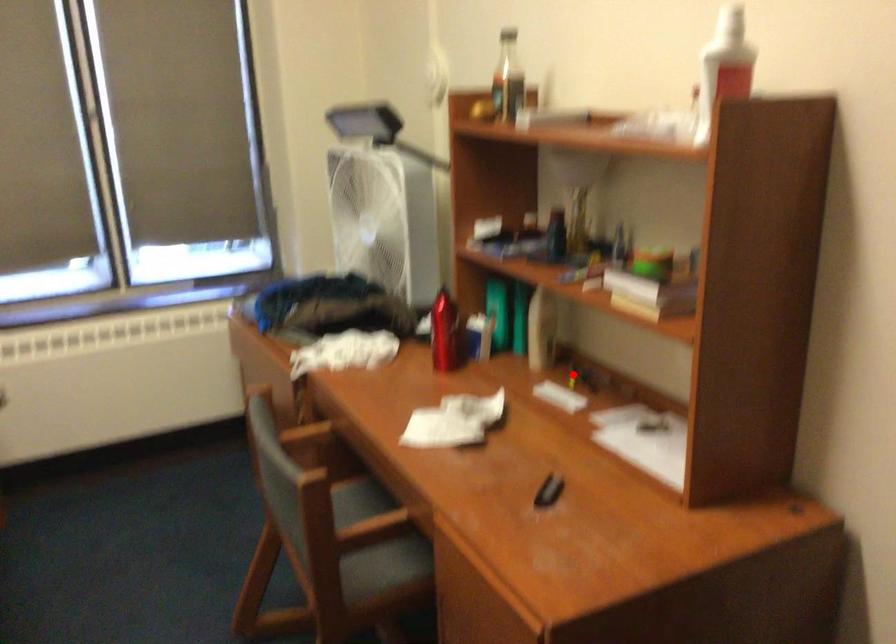
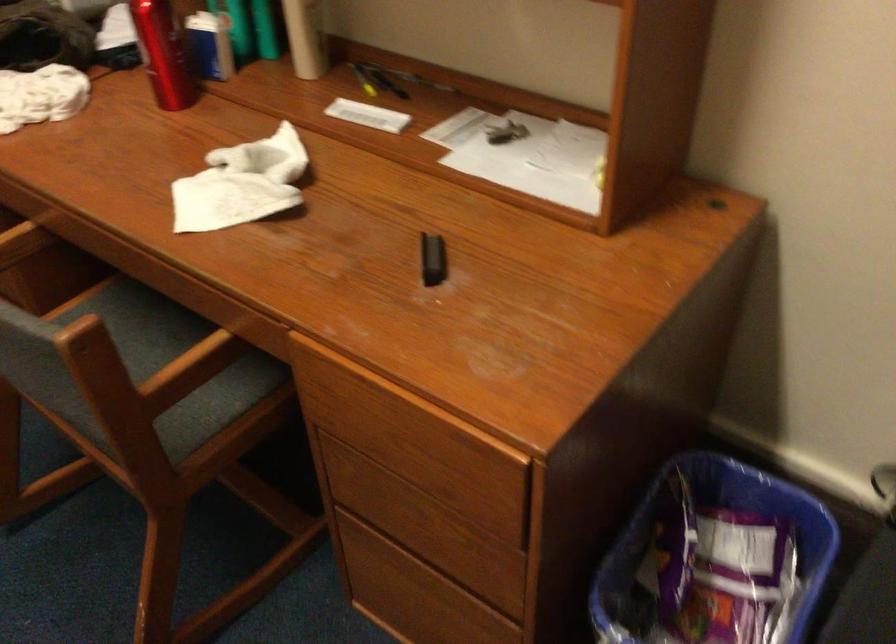
Question: A red point is marked in image1. In image2, is the corresponding 3D point closer to the camera or farther? Reply with the corresponding letter.

Choices:
 (A) The corresponding 3D point is closer.
 (B) The corresponding 3D point is farther.

Answer: (A)